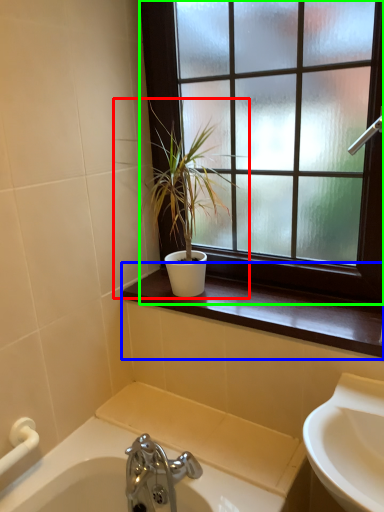
Question: Considering the real-world distances, which object is farthest from houseplant (highlighted by a red box)? window sill (highlighted by a blue box) or window (highlighted by a green box)?

Choices:
 (A) window sill
 (B) window

Answer: (A)